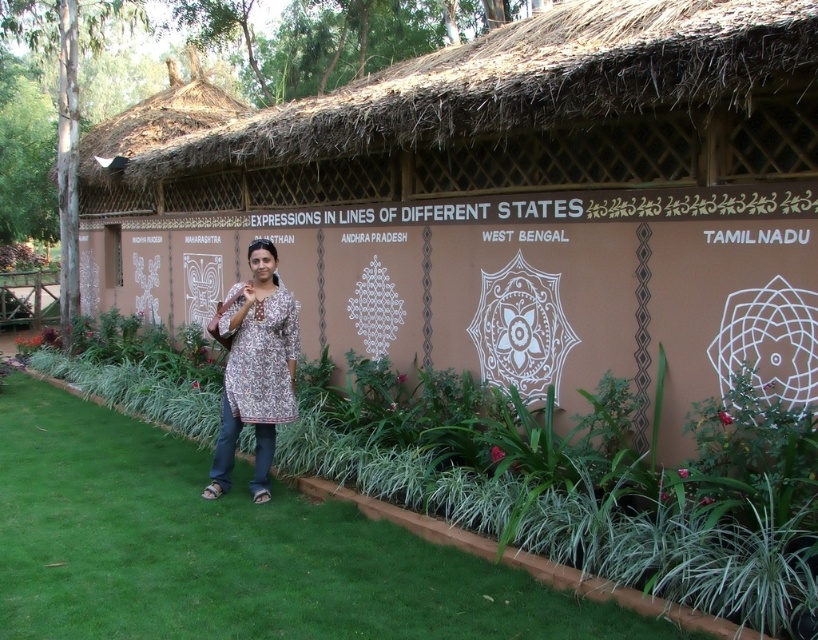
Can you confirm if brown thatched roof hut at center is bigger than printed cotton kurta at center?

Indeed, brown thatched roof hut at center has a larger size compared to printed cotton kurta at center.

Where is `brown thatched roof hut at center`? The height and width of the screenshot is (640, 818). brown thatched roof hut at center is located at coordinates (511, 204).

The height and width of the screenshot is (640, 818). I want to click on green grass at lower center, so click(228, 550).

Can you confirm if green grass at lower center is positioned above printed cotton kurta at center?

No.

Is point (151, 580) positioned in front of point (257, 284)?

Yes, it is in front of point (257, 284).

Image resolution: width=818 pixels, height=640 pixels. I want to click on green grass at lower center, so click(228, 550).

Based on the photo, who is more distant from viewer, (x=745, y=124) or (x=504, y=636)?

The point (x=745, y=124) is behind.

Where is `brown thatched roof hut at center`? This screenshot has width=818, height=640. brown thatched roof hut at center is located at coordinates (511, 204).